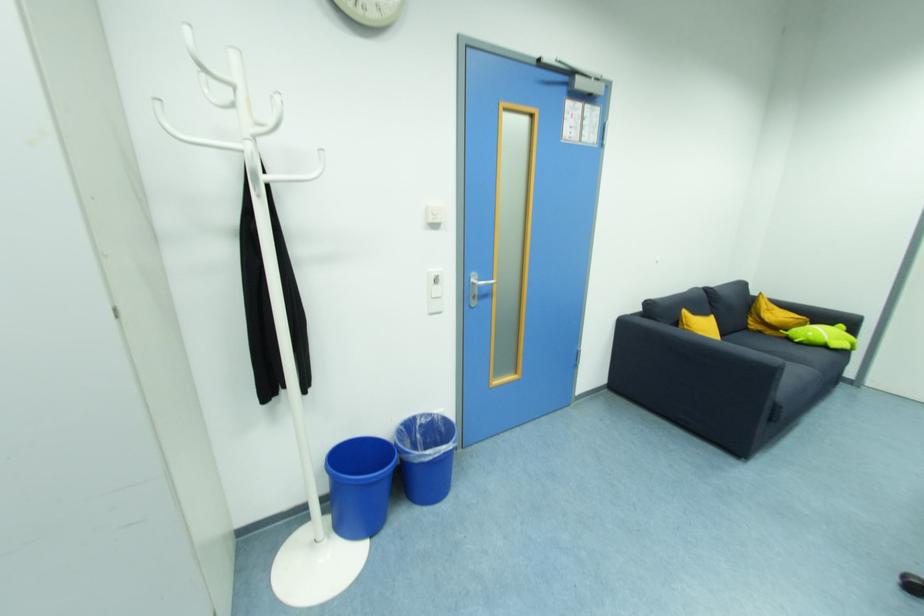
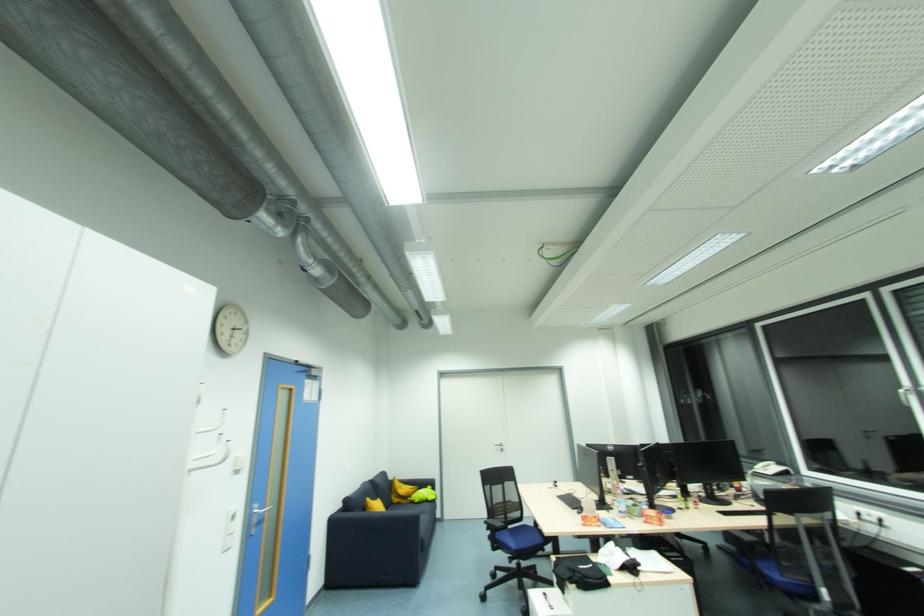
Where in the second image is the point corresponding to point (482, 286) from the first image?

(261, 517)